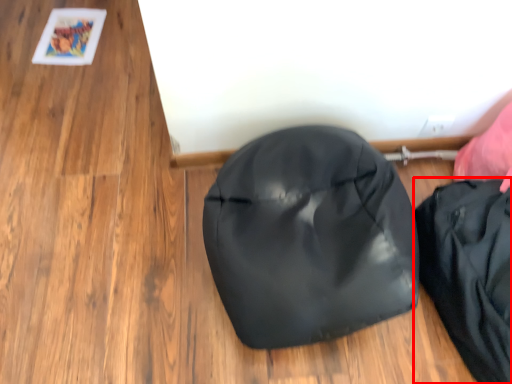
Question: From the image's perspective, what is the correct spatial positioning of pouch (annotated by the red box) in reference to footwear?

Choices:
 (A) above
 (B) below

Answer: (B)